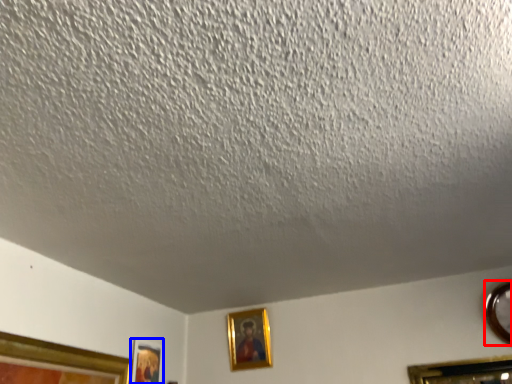
Question: Which of the following is the closest to the observer, picture frame (highlighted by a red box) or picture frame (highlighted by a blue box)?

Choices:
 (A) picture frame
 (B) picture frame

Answer: (A)